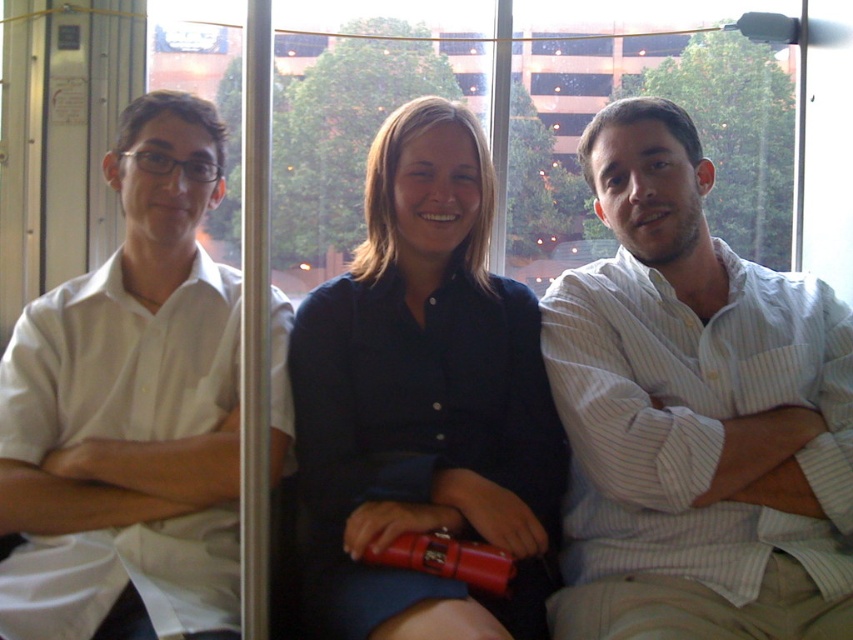
Question: Is white striped shirt at center to the left of white smooth shirt at left from the viewer's perspective?

Choices:
 (A) yes
 (B) no

Answer: (B)

Question: Can you confirm if white striped shirt at center is thinner than white smooth shirt at left?

Choices:
 (A) yes
 (B) no

Answer: (B)

Question: Is white striped shirt at center wider than dark blue shirt at center?

Choices:
 (A) yes
 (B) no

Answer: (A)

Question: Which point is closer to the camera taking this photo?

Choices:
 (A) (717, 531)
 (B) (218, 115)
 (C) (477, 497)

Answer: (C)

Question: Which is farther from the dark blue shirt at center?

Choices:
 (A) white smooth shirt at left
 (B) white striped shirt at center

Answer: (A)

Question: Which point is farther to the camera?

Choices:
 (A) white smooth shirt at left
 (B) dark blue shirt at center
 (C) white striped shirt at center

Answer: (A)